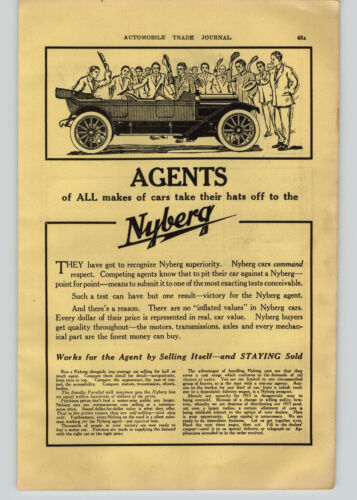
I want to click on hood, so click(221, 97).